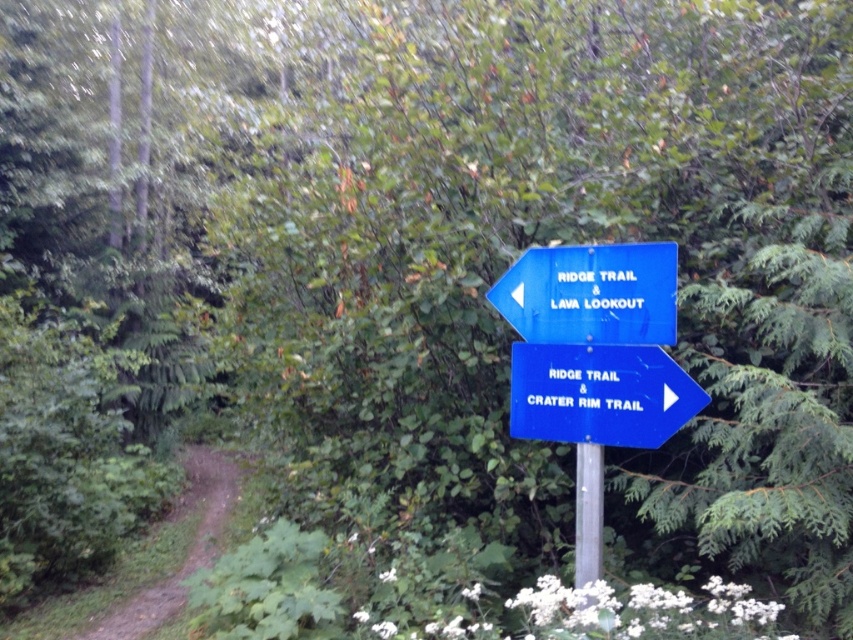
You are a hiker standing at the dirt path and see the blue plastic sign at center and the blue plastic sign at upper right. Which sign should you look at first if you want to follow the Ridge Trail towards Lava Lookout?

The blue plastic sign at center is located below the blue plastic sign at upper right. Since the top sign points to Ridge Trail and Lava Lookout, you should look at the blue plastic sign at upper right first as it indicates the direction for Lava Lookout.